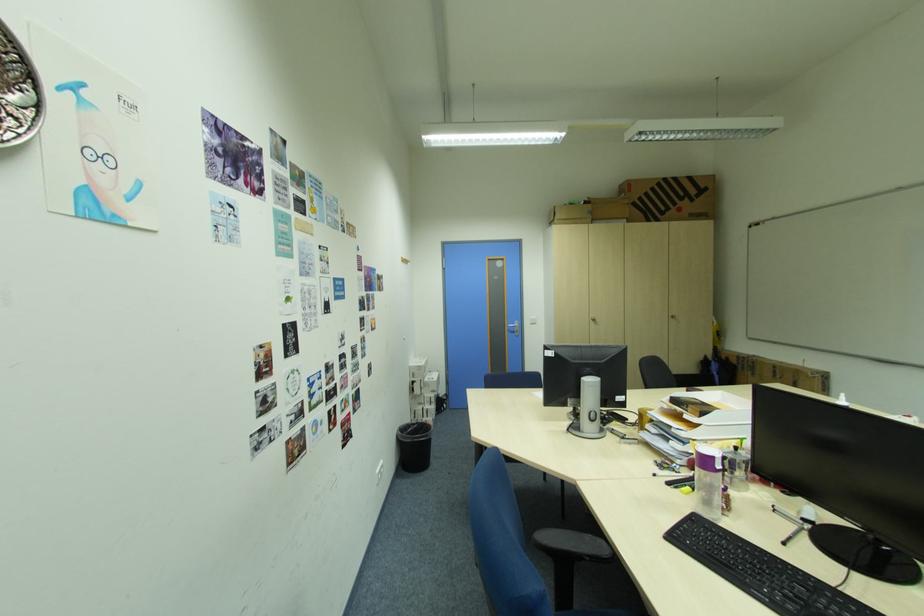
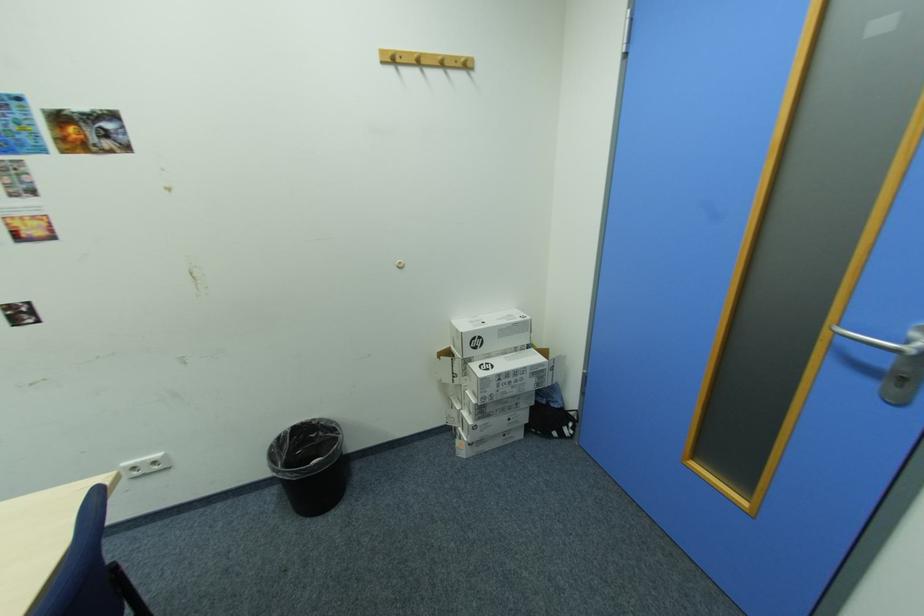
Find the pixel in the second image that matches [427,367] in the first image.

(465, 331)